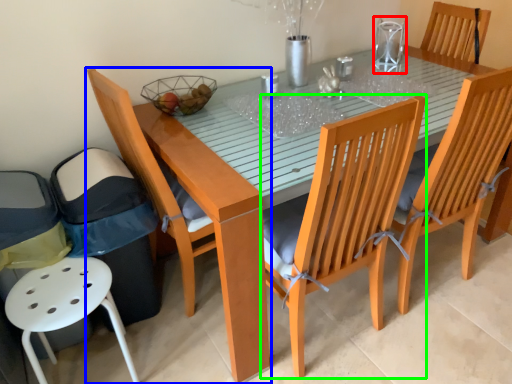
Question: Which object is positioned farthest from clear (highlighted by a red box)? Select from chair (highlighted by a blue box) and chair (highlighted by a green box).

Choices:
 (A) chair
 (B) chair

Answer: (A)